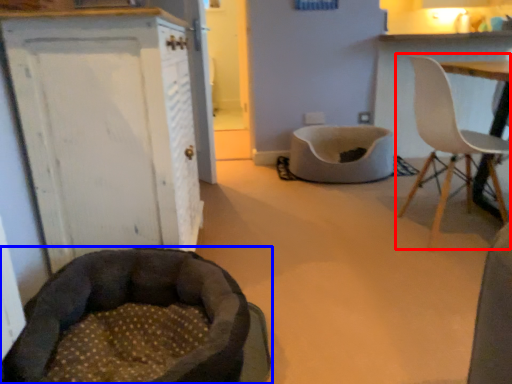
Question: Among these objects, which one is nearest to the camera, chair (highlighted by a red box) or dog bed (highlighted by a blue box)?

Choices:
 (A) chair
 (B) dog bed

Answer: (B)